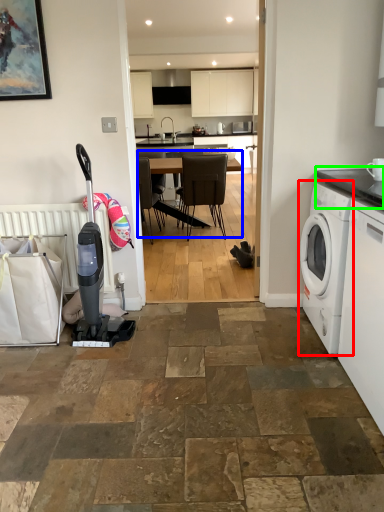
Question: Considering the real-world distances, which object is closest to washing machine (highlighted by a red box)? kitchen & dining room table (highlighted by a blue box) or countertop (highlighted by a green box).

Choices:
 (A) kitchen & dining room table
 (B) countertop

Answer: (B)